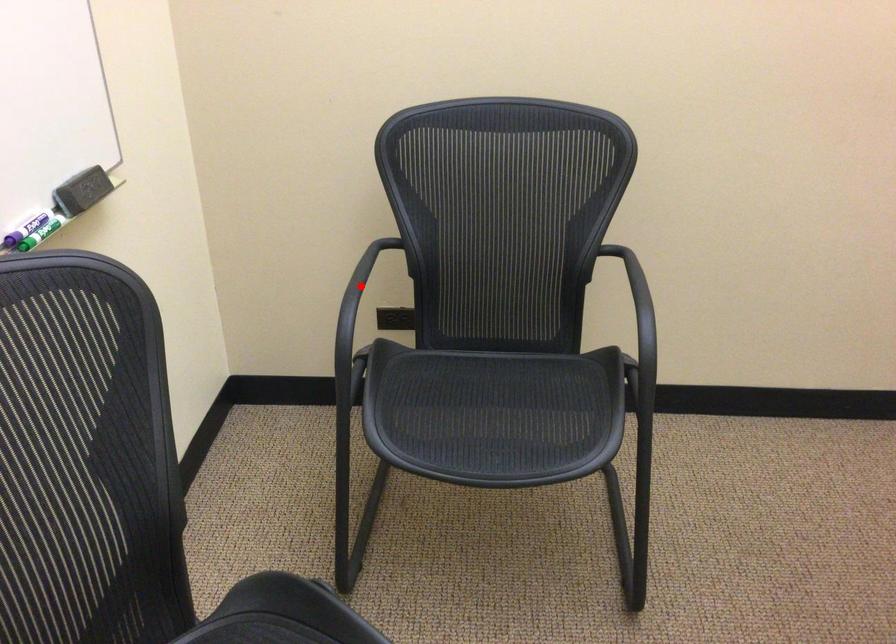
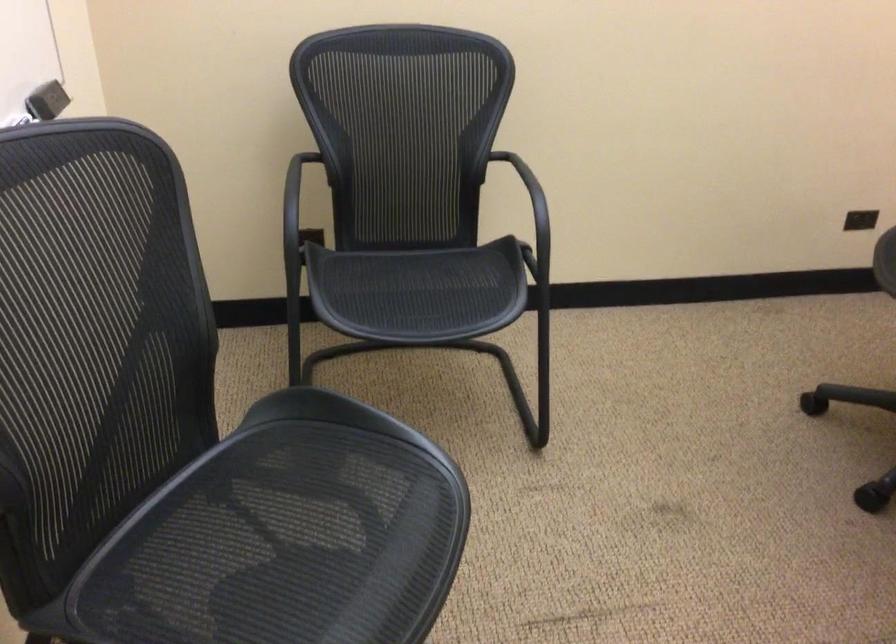
Question: I am providing you with two images of the same scene from different viewpoints. A red point is marked on the first image. Can you still see the location of the red point in image 2?

Choices:
 (A) Yes
 (B) No

Answer: (B)